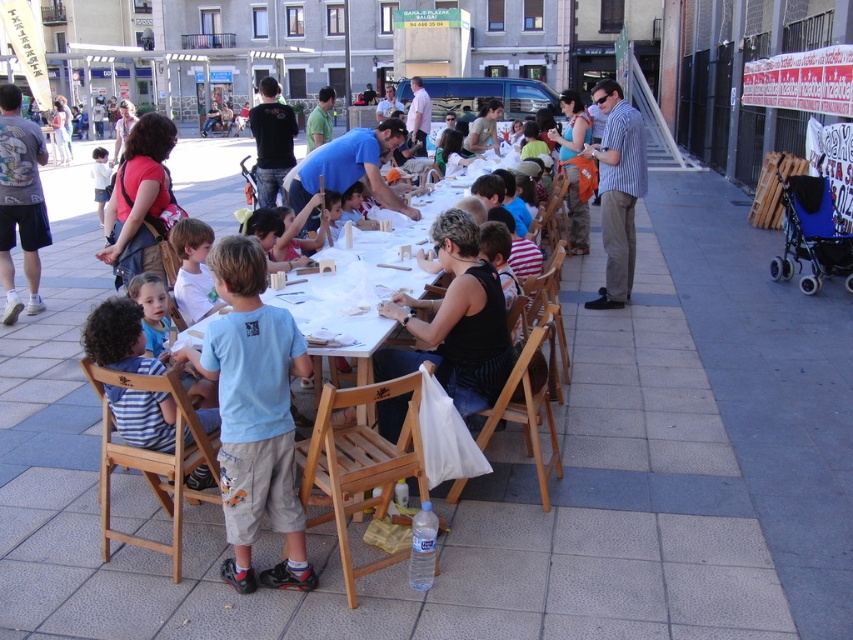
Question: Can you confirm if light blue t-shirt at center is positioned below black cotton shirt at upper center?

Choices:
 (A) yes
 (B) no

Answer: (A)

Question: Considering the relative positions of matte red shirt at center and blue shirt at center in the image provided, where is matte red shirt at center located with respect to blue shirt at center?

Choices:
 (A) right
 (B) left

Answer: (B)

Question: Among these objects, which one is farthest from the camera?

Choices:
 (A) black cotton shirt at upper center
 (B) blue shirt at center
 (C) matte red shirt at center
 (D) striped shirt at right

Answer: (A)

Question: Which point is closer to the camera?

Choices:
 (A) (287, 330)
 (B) (299, 182)

Answer: (A)

Question: Is light blue t-shirt at center above striped shirt at right?

Choices:
 (A) no
 (B) yes

Answer: (A)

Question: Which point appears closest to the camera in this image?

Choices:
 (A) (132, 154)
 (B) (10, 240)
 (C) (283, 138)
 (D) (355, 170)

Answer: (A)